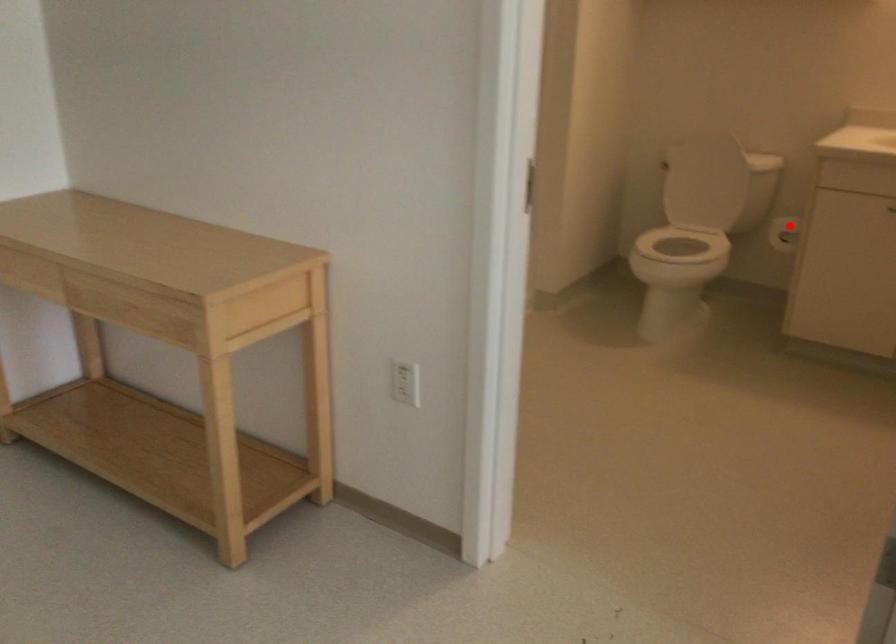
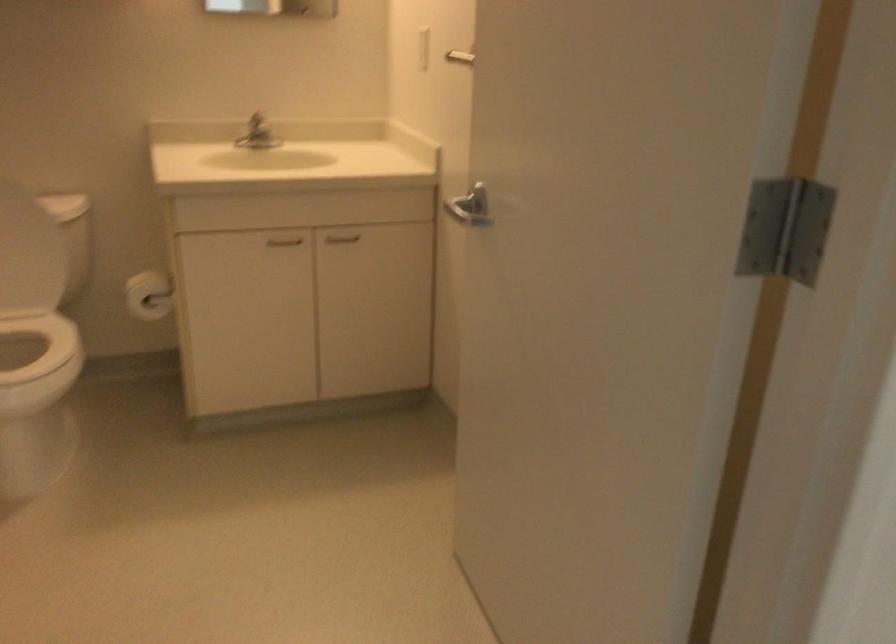
Question: I am providing you with two images of the same scene from different viewpoints. Given a red point in image1, look at the same physical point in image2. Is it:

Choices:
 (A) Closer to the viewpoint
 (B) Farther from the viewpoint

Answer: (A)